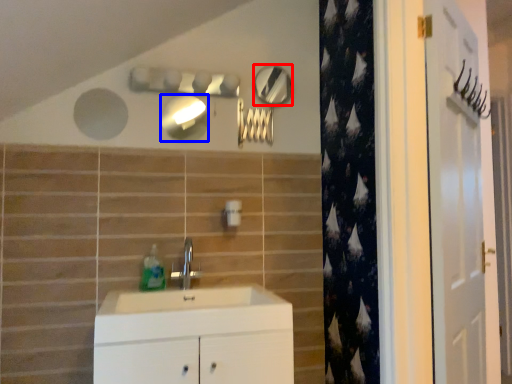
Question: Among these objects, which one is farthest to the camera, mirror (highlighted by a red box) or mirror (highlighted by a blue box)?

Choices:
 (A) mirror
 (B) mirror

Answer: (A)